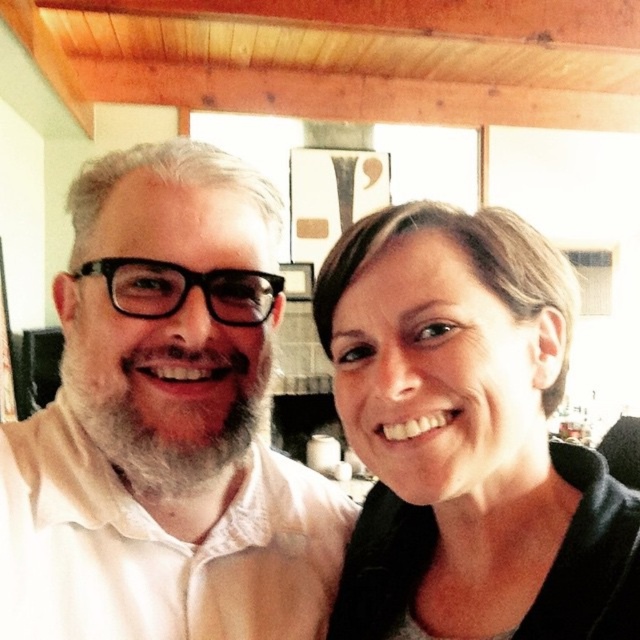
Question: Does matte black hair at upper right have a larger size compared to white matte beard at left?

Choices:
 (A) yes
 (B) no

Answer: (A)

Question: Among these objects, which one is farthest from the camera?

Choices:
 (A) white matte beard at left
 (B) matte black hair at upper right

Answer: (A)

Question: In this image, where is matte black hair at upper right located relative to white matte beard at left?

Choices:
 (A) below
 (B) above

Answer: (A)

Question: Which object is farther from the camera taking this photo?

Choices:
 (A) matte black hair at upper right
 (B) white matte beard at left

Answer: (B)

Question: Can you confirm if matte black hair at upper right is positioned above white matte beard at left?

Choices:
 (A) yes
 (B) no

Answer: (B)